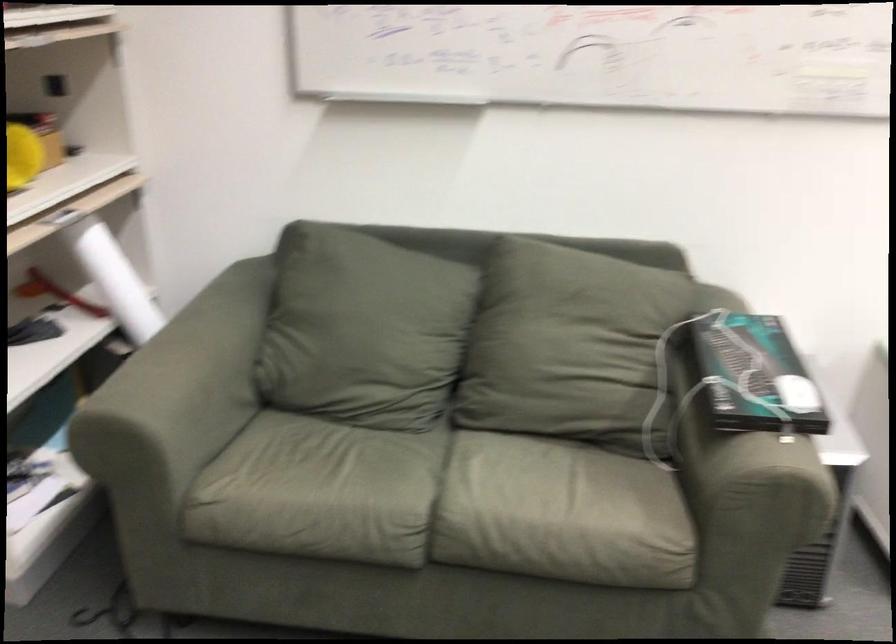
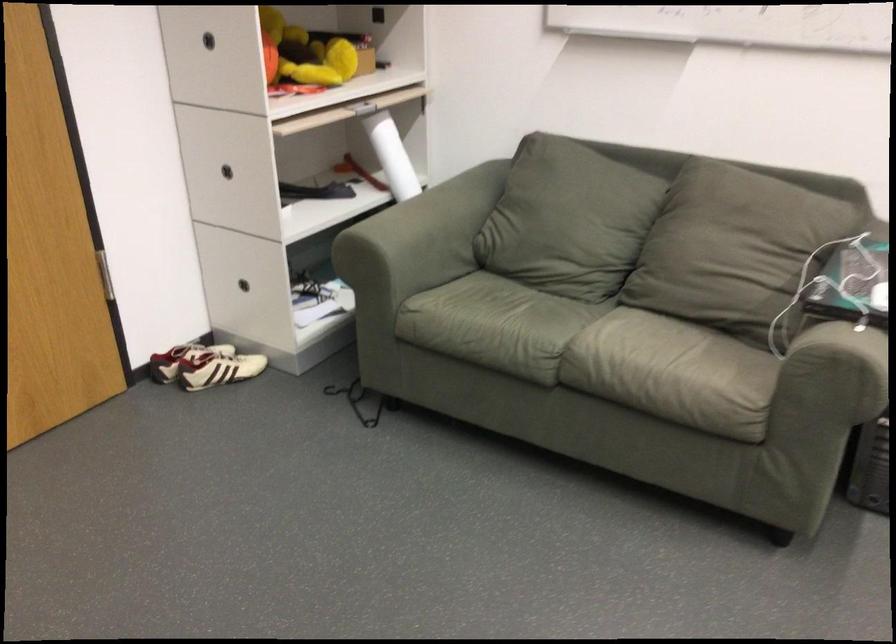
Where in the second image is the point corresponding to point 333,496 from the first image?

(495, 325)